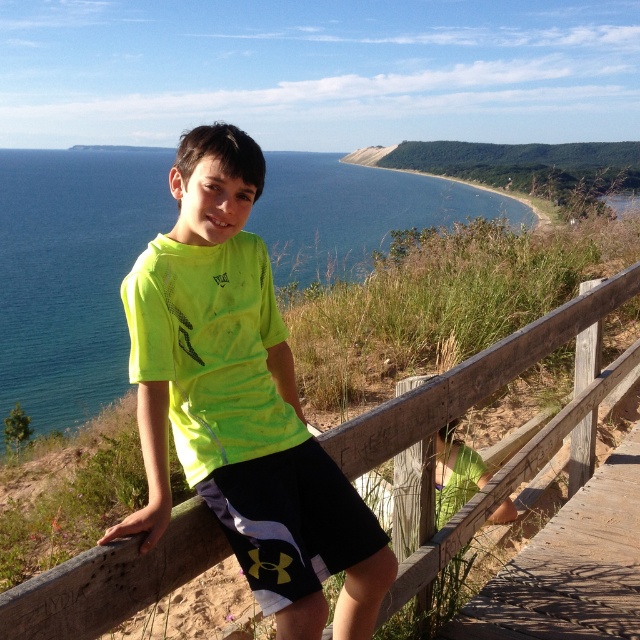
Question: Can you confirm if blue water at upper left is positioned to the right of black synthetic shorts at center?

Choices:
 (A) no
 (B) yes

Answer: (A)

Question: Which object is positioned farthest from the wooden at center?

Choices:
 (A) black synthetic shorts at center
 (B) green matte fence at lower center
 (C) neon yellow t-shirt at center
 (D) blue water at upper left

Answer: (D)

Question: Which of the following is the farthest from the observer?

Choices:
 (A) neon yellow t-shirt at center
 (B) blue water at upper left

Answer: (B)

Question: Can you confirm if neon yellow t-shirt at center is bigger than green matte fence at lower center?

Choices:
 (A) no
 (B) yes

Answer: (B)

Question: Can you confirm if blue water at upper left is positioned above black synthetic shorts at center?

Choices:
 (A) no
 (B) yes

Answer: (B)

Question: Based on their relative distances, which object is nearer to the blue water at upper left?

Choices:
 (A) green matte fence at lower center
 (B) wooden at center
 (C) black synthetic shorts at center

Answer: (C)